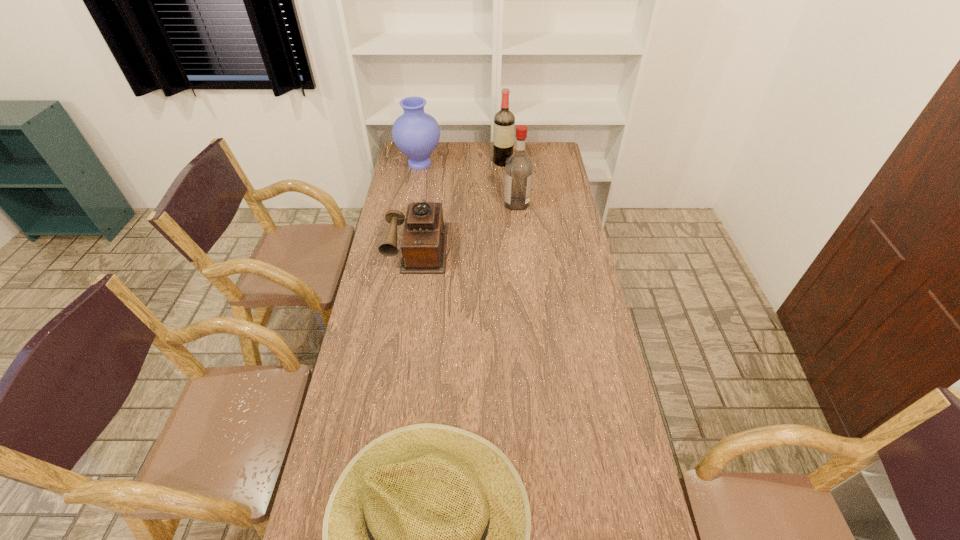
I want to click on the farther liquor, so click(504, 121).

Locate an element on the screen. the third nearest object is located at coordinates (518, 168).

Identify the location of vase. (416, 133).

In order to click on phonograph_record in this screenshot , I will do `click(424, 241)`.

Find the location of a particular element. The image size is (960, 540). free space located on the front-facing side of the farther liquor is located at coordinates (504, 174).

Locate an element on the screen. vacant space located 0.190m on the front-facing side of the third nearest object is located at coordinates (462, 204).

Locate an element on the screen. The height and width of the screenshot is (540, 960). vacant space situated on the front-facing side of the third nearest object is located at coordinates (451, 204).

I want to click on vacant space located on the front-facing side of the third nearest object, so click(x=460, y=204).

Where is `free space located 0.150m on the right of the vase`? The height and width of the screenshot is (540, 960). free space located 0.150m on the right of the vase is located at coordinates (472, 164).

Identify the location of vacant space located 0.070m on the horn of the second nearest object. (412, 287).